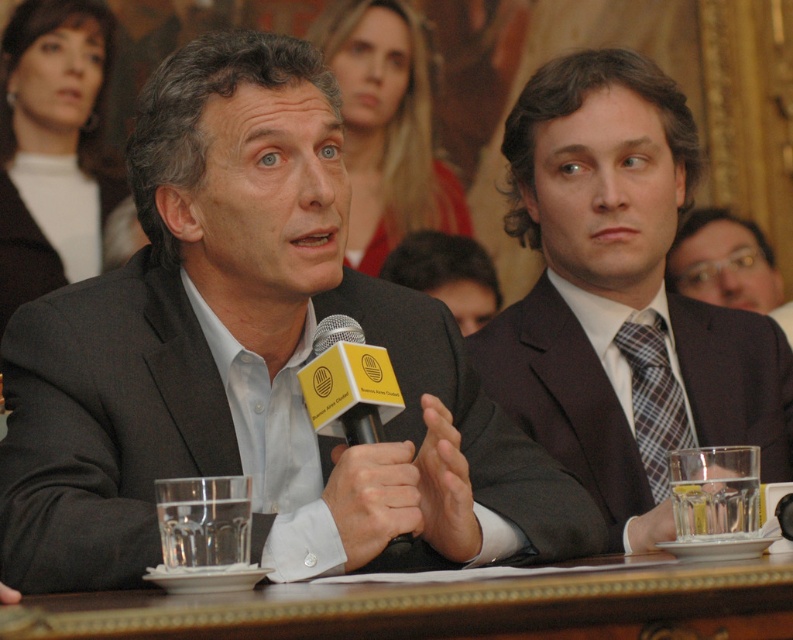
Does dark brown suit at center appear on the right side of matte black suit at center?

Yes, dark brown suit at center is to the right of matte black suit at center.

Does dark brown suit at center have a smaller size compared to matte black suit at center?

No.

At what (x,y) coordinates should I click in order to perform the action: click on dark brown suit at center. Please return your answer as a coordinate pair (x, y). The image size is (793, 640). Looking at the image, I should click on (621, 298).

Is dark brown suit at center positioned in front of brown wooden table at center?

No, it is not.

Consider the image. Between dark brown suit at center and brown wooden table at center, which one appears on the left side from the viewer's perspective?

From the viewer's perspective, brown wooden table at center appears more on the left side.

Locate an element on the screen. dark brown suit at center is located at coordinates pyautogui.click(x=621, y=298).

Find the location of `dark brown suit at center`. dark brown suit at center is located at coordinates (621, 298).

Is point (267, 186) positioned behind point (642, 177)?

No, it is not.

Who is higher up, matte gray suit at center or dark brown suit at center?

dark brown suit at center is above.

Does point (239, 237) lie behind point (548, 256)?

No.

Identify the location of matte gray suit at center. (251, 360).